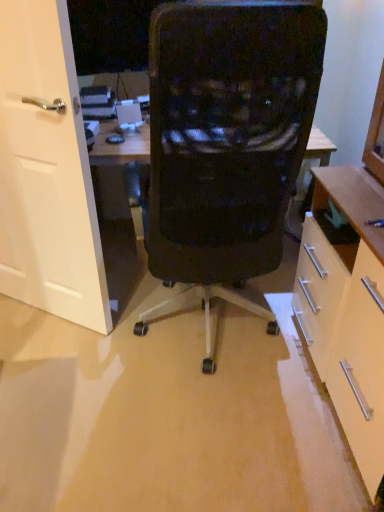
Find the location of `free area below white matte door at left (from a real-world perspective)`. free area below white matte door at left (from a real-world perspective) is located at coordinates (37, 308).